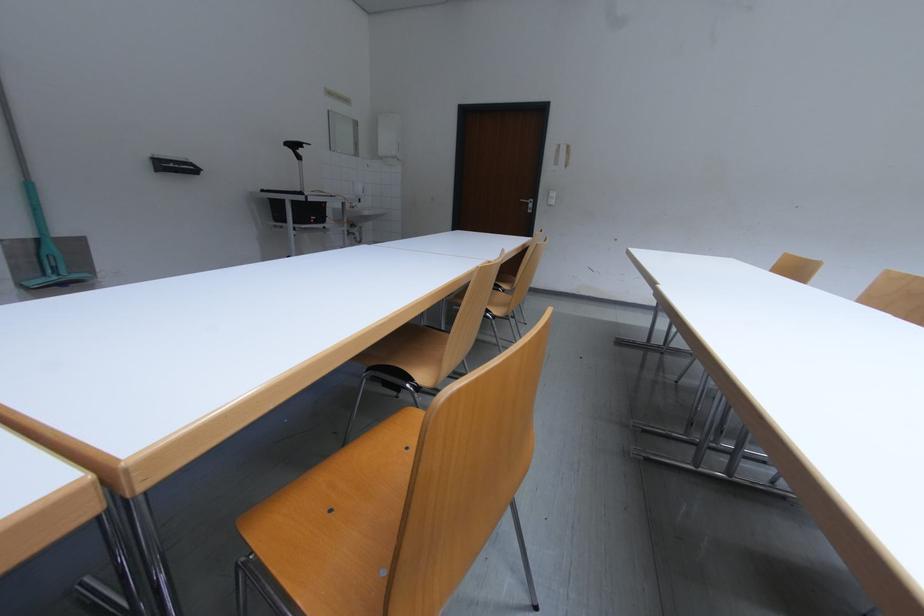
Where would you pull the faucet handle? Please return your answer as a coordinate pair (x, y).

(347, 204)